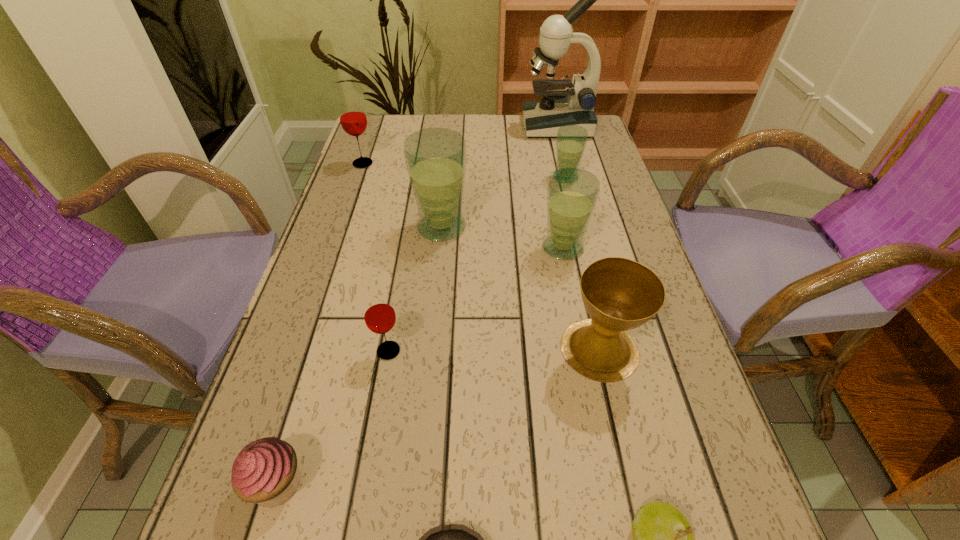
What are the coordinates of `microscope` in the screenshot? It's located at (543, 118).

In order to click on the farthest object in this screenshot , I will do `click(543, 118)`.

Image resolution: width=960 pixels, height=540 pixels. I want to click on the biggest blue glass, so click(x=435, y=158).

You are a GUI agent. You are given a task and a screenshot of the screen. Output one action in this format:
    pyautogui.click(x=<x>, y=<y>)
    Task: Click on the ninth shortest object
    The height and width of the screenshot is (540, 960).
    Given the screenshot: What is the action you would take?
    pyautogui.click(x=435, y=158)

In order to click on the leftmost glass in this screenshot , I will do `click(353, 119)`.

Find the location of a particular element. The width and height of the screenshot is (960, 540). the left red glass is located at coordinates (353, 119).

Identify the location of the second biggest blue glass. This screenshot has width=960, height=540. (572, 193).

The image size is (960, 540). I want to click on brown chalice, so click(x=619, y=294).

Locate an element on the screen. The height and width of the screenshot is (540, 960). the smallest blue glass is located at coordinates (571, 140).

Find the location of a particular element. the nearer red glass is located at coordinates (379, 314).